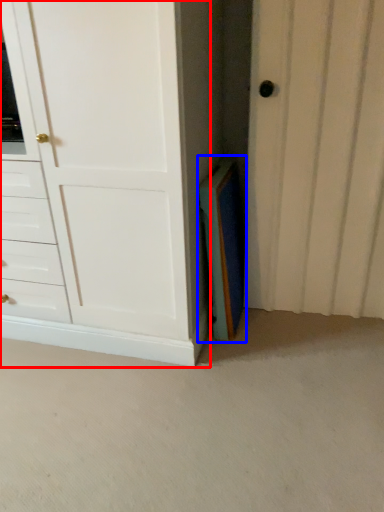
Question: Which object is further to the camera taking this photo, chest of drawers (highlighted by a red box) or paperback book (highlighted by a blue box)?

Choices:
 (A) chest of drawers
 (B) paperback book

Answer: (B)